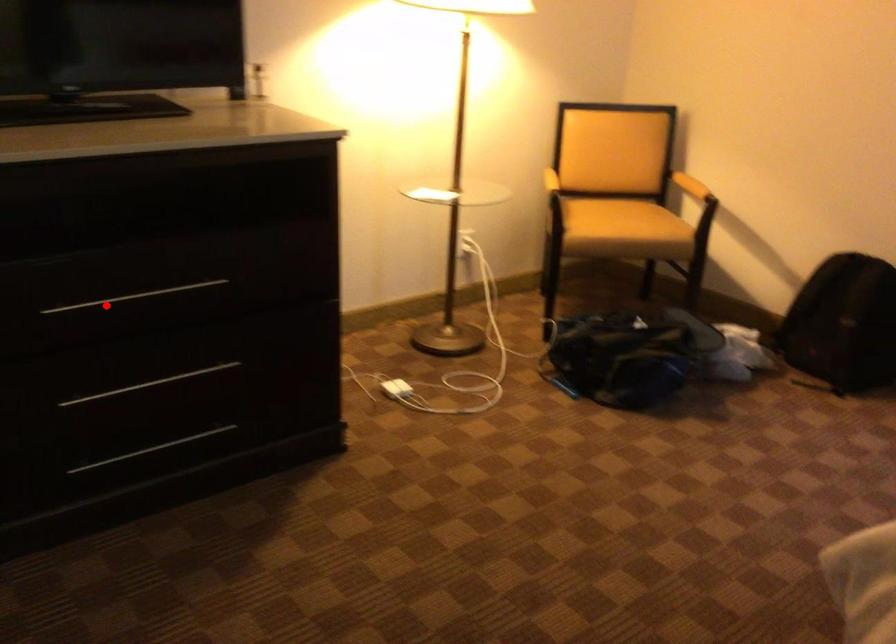
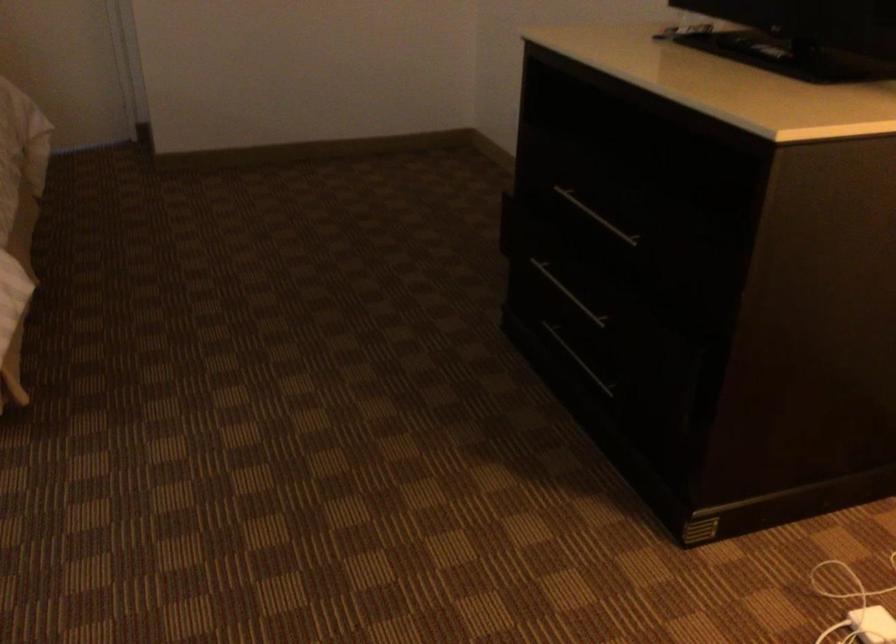
Question: I am providing you with two images of the same scene from different viewpoints. Image1 has a red point marked. In image2, the corresponding 3D location appears at what relative position? Reply with the corresponding letter.

Choices:
 (A) Closer
 (B) Farther

Answer: (B)